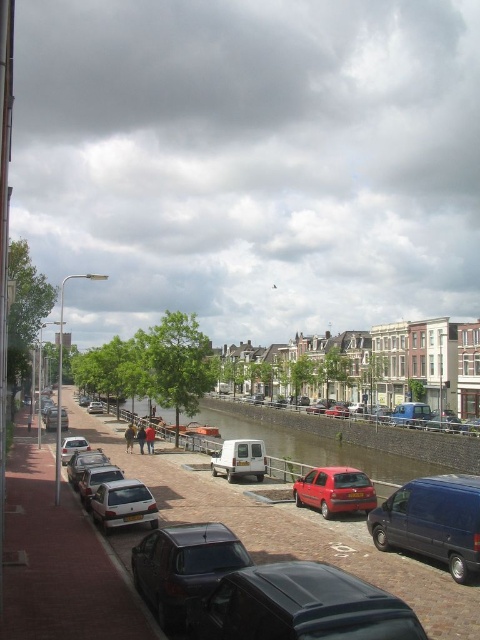
Which of these two, matte silver car at center or silver metallic hatchback at center, stands taller?

matte silver car at center

Is matte silver car at center smaller than silver metallic hatchback at center?

Actually, matte silver car at center might be larger than silver metallic hatchback at center.

You are a GUI agent. You are given a task and a screenshot of the screen. Output one action in this format:
    pyautogui.click(x=<x>, y=<y>)
    Task: Click on the matte silver car at center
    This screenshot has width=480, height=640.
    Given the screenshot: What is the action you would take?
    pyautogui.click(x=50, y=419)

Can you confirm if shiny red car at lower center is wider than white matte van at center?

Yes.

What do you see at coordinates (335, 490) in the screenshot? I see `shiny red car at lower center` at bounding box center [335, 490].

Who is more distant from viewer, (324, 515) or (229, 449)?

Point (229, 449)

Find the location of a particular element. The image size is (480, 640). shiny red car at lower center is located at coordinates (335, 490).

Consider the image. Is white matte van at center below silver metallic hatchback at center?

Yes, white matte van at center is below silver metallic hatchback at center.

Can you confirm if white matte van at center is smaller than silver metallic hatchback at center?

No.

Describe the element at coordinates (240, 460) in the screenshot. I see `white matte van at center` at that location.

Identify the location of white matte van at center. Image resolution: width=480 pixels, height=640 pixels. 240,460.